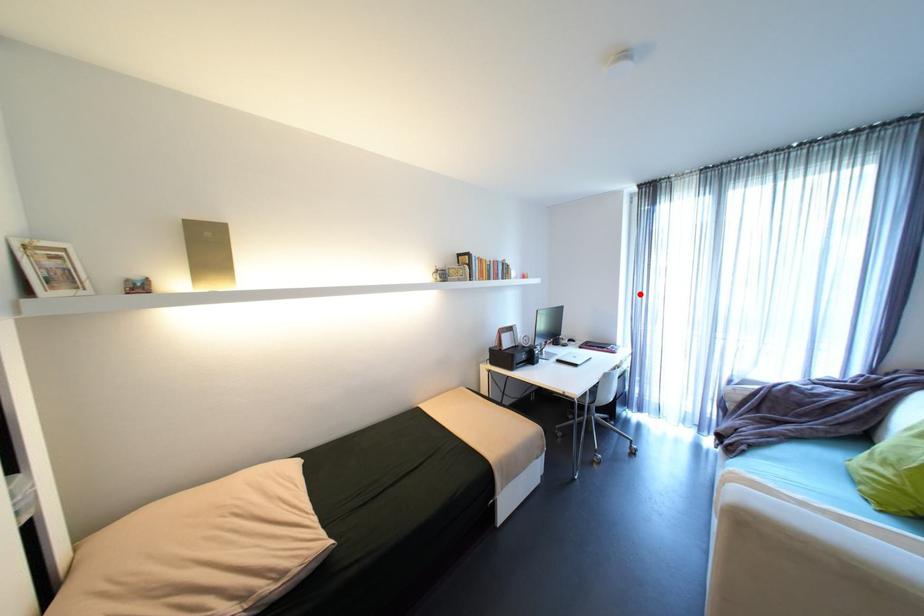
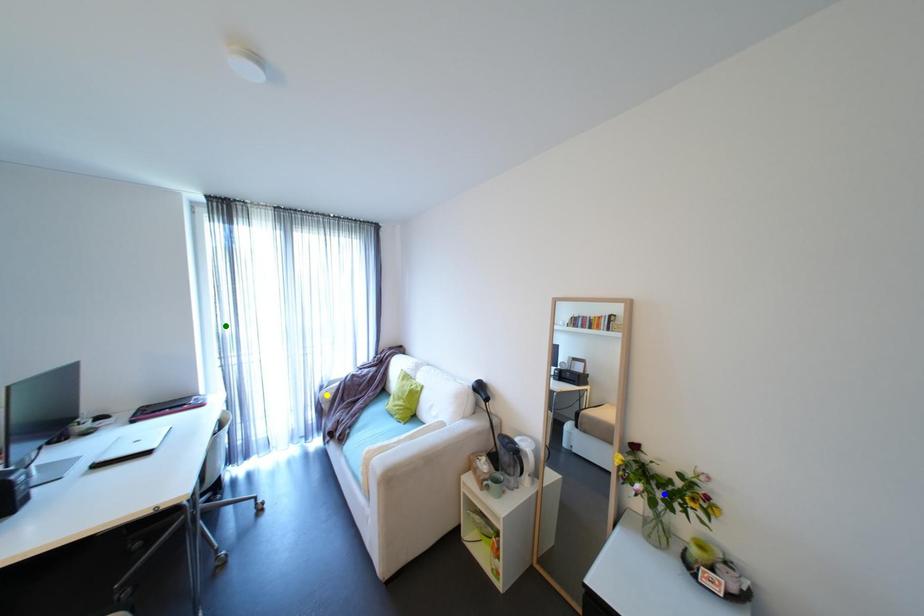
Question: I am providing you with two images of the same scene from different viewpoints. A red point is marked on the first image. You are given multiple points on the second image. Which point in image 2 is actually the same real-world point as the red point in image 1?

Choices:
 (A) green point
 (B) yellow point
 (C) blue point

Answer: (A)